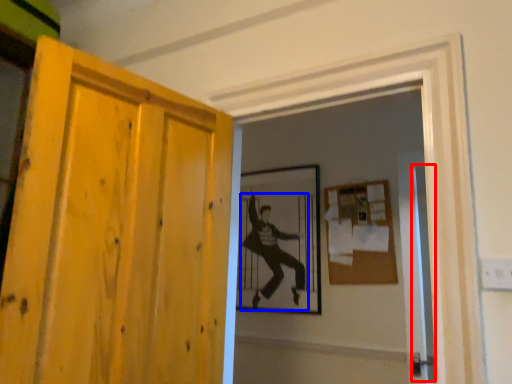
Question: Among these objects, which one is farthest to the camera, screen door (highlighted by a red box) or person (highlighted by a blue box)?

Choices:
 (A) screen door
 (B) person

Answer: (B)